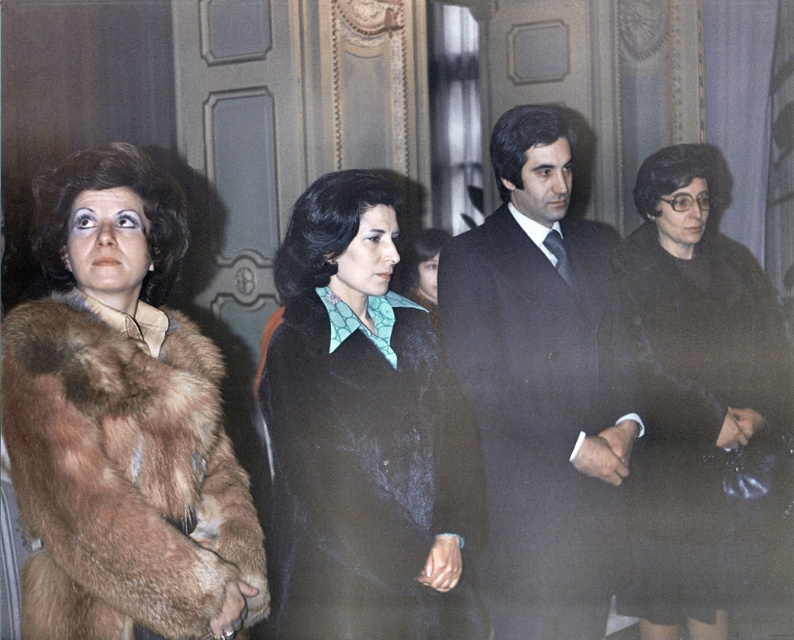
You are standing in the room and want to reach both points, point (649, 381) and point (419, 289). Which point should you go to first if you want to reach the one closer to you first?

Point (649, 381) is closer to the viewer than point (419, 289), so you should go to point (649, 381) first.

You are a photographer setting up a shoot in a formal indoor setting with ornate paneling. You need to ensure that the velvet black coat at center and the velvet teal blouse at center are both visible in the final photo. Based on their positions, which object should you adjust to ensure both are fully visible?

The velvet black coat at center is in front of the velvet teal blouse at center. To ensure both are fully visible, you should adjust the velvet black coat at center to move it slightly backward or to the side so it does not block the velvet teal blouse at center.

You are a photographer setting up for a group photo. You need to ensure that the dark suit at center and the black wool coat at center are both visible in the frame. Based on their positions, which one should you focus on first to ensure proper alignment?

The dark suit at center is positioned on the left side of the black wool coat at center, so you should focus on the dark suit at center first to ensure proper alignment as it is on the left side.